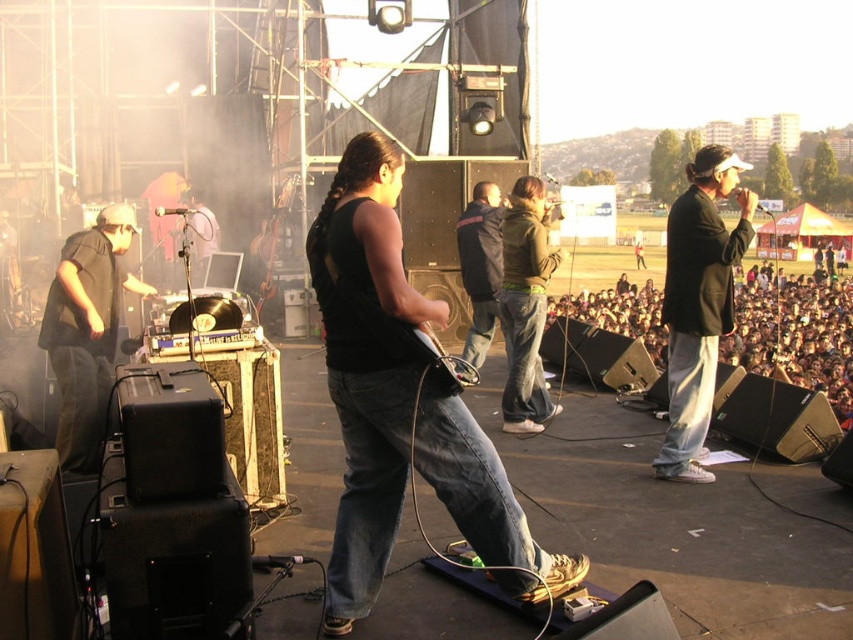
Is dark brown cardboard crowd at right further to camera compared to green fleece jacket at center?

That is False.

Does dark brown cardboard crowd at right come in front of green fleece jacket at center?

Yes, dark brown cardboard crowd at right is in front of green fleece jacket at center.

Is point (755, 362) closer to viewer compared to point (519, 308)?

No, it is behind (519, 308).

I want to click on dark brown cardboard crowd at right, so click(796, 333).

Is dark brown cardboard crowd at right thinner than dark blue jeans at center?

Incorrect, dark brown cardboard crowd at right's width is not less than dark blue jeans at center's.

Is dark brown cardboard crowd at right taller than dark blue jeans at center?

Yes.

Where is `dark brown cardboard crowd at right`? dark brown cardboard crowd at right is located at coordinates (796, 333).

The height and width of the screenshot is (640, 853). Identify the location of dark brown cardboard crowd at right. [x=796, y=333].

Is black matte clothing at left positioned in front of dark blue jeans at center?

Yes, black matte clothing at left is in front of dark blue jeans at center.

Identify the location of black matte clothing at left. Image resolution: width=853 pixels, height=640 pixels. (86, 332).

Where is `black matte clothing at left`? black matte clothing at left is located at coordinates (86, 332).